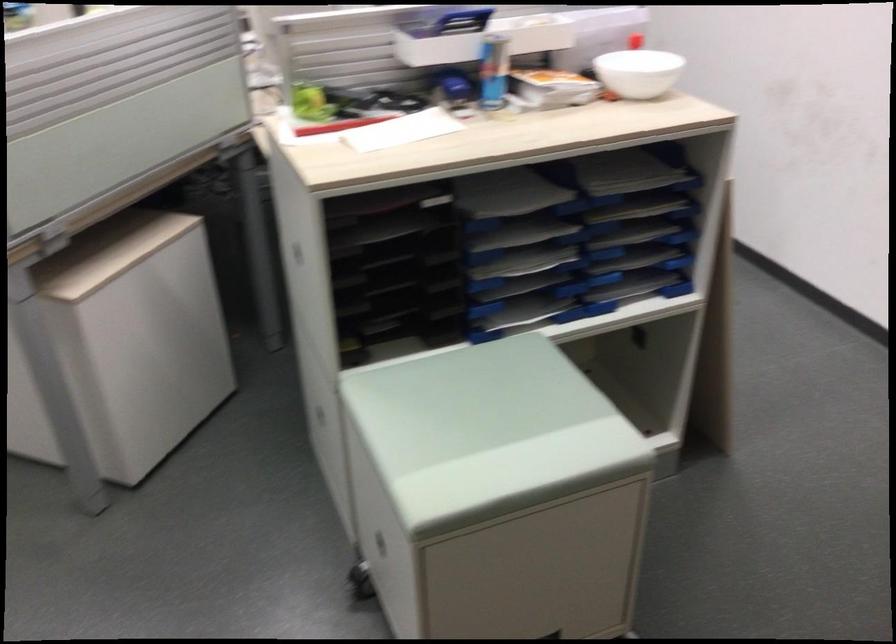
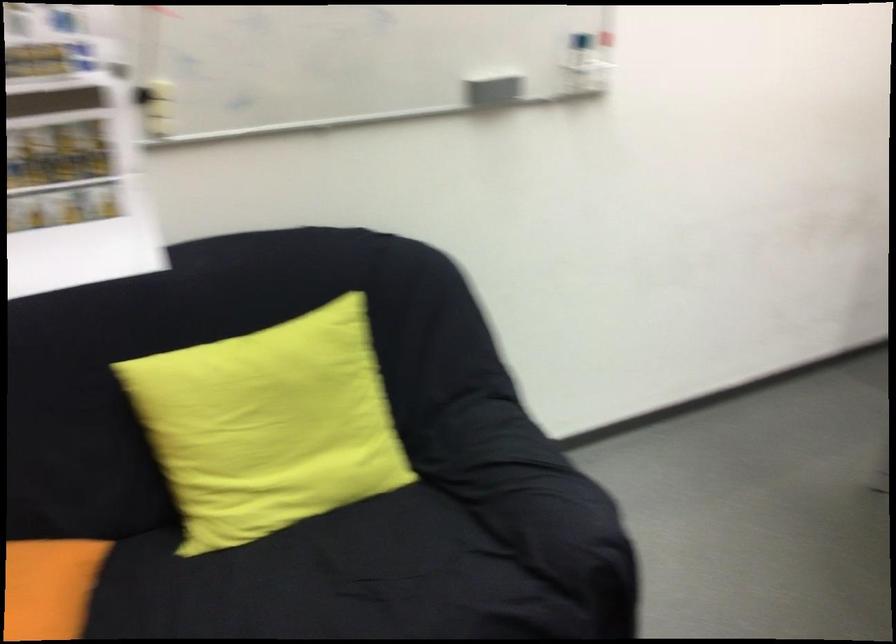
How did the camera likely rotate?

The camera rotated toward left-down.